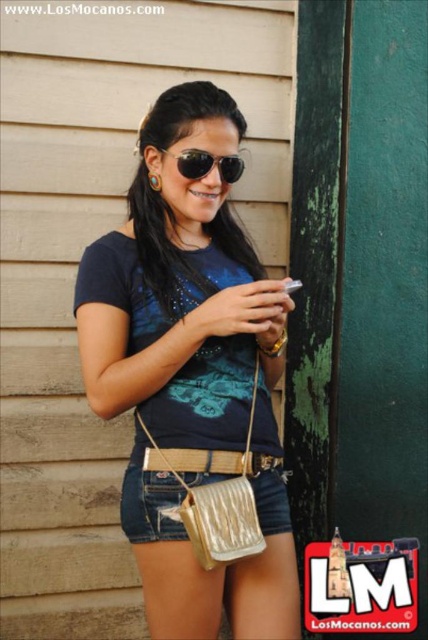
Does metallic gold purse at center appear on the left side of sunglasses at center?

Indeed, metallic gold purse at center is positioned on the left side of sunglasses at center.

What do you see at coordinates (190, 374) in the screenshot? I see `metallic gold purse at center` at bounding box center [190, 374].

Where is `metallic gold purse at center`? metallic gold purse at center is located at coordinates (190, 374).

Who is positioned more to the right, metallic gold purse at center or metallic gold purse at lower center?

Positioned to the right is metallic gold purse at lower center.

The image size is (428, 640). I want to click on metallic gold purse at center, so click(190, 374).

Does metallic gold purse at lower center lie in front of sunglasses at center?

Yes, metallic gold purse at lower center is in front of sunglasses at center.

Can you confirm if metallic gold purse at lower center is positioned above sunglasses at center?

Actually, metallic gold purse at lower center is below sunglasses at center.

Describe the element at coordinates (149, 506) in the screenshot. This screenshot has width=428, height=640. I see `metallic gold purse at lower center` at that location.

Locate an element on the screen. metallic gold purse at lower center is located at coordinates (149, 506).